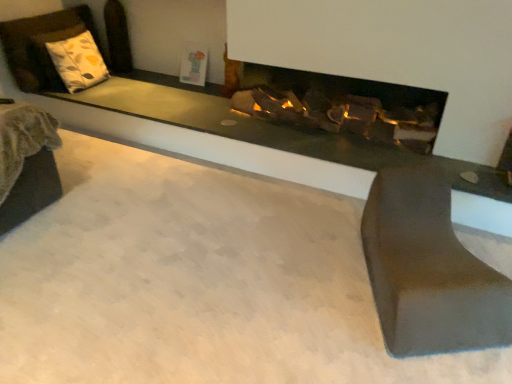
What are the coordinates of `vacant space situated on the left part of matte gray bench at lower right` in the screenshot? It's located at (289, 281).